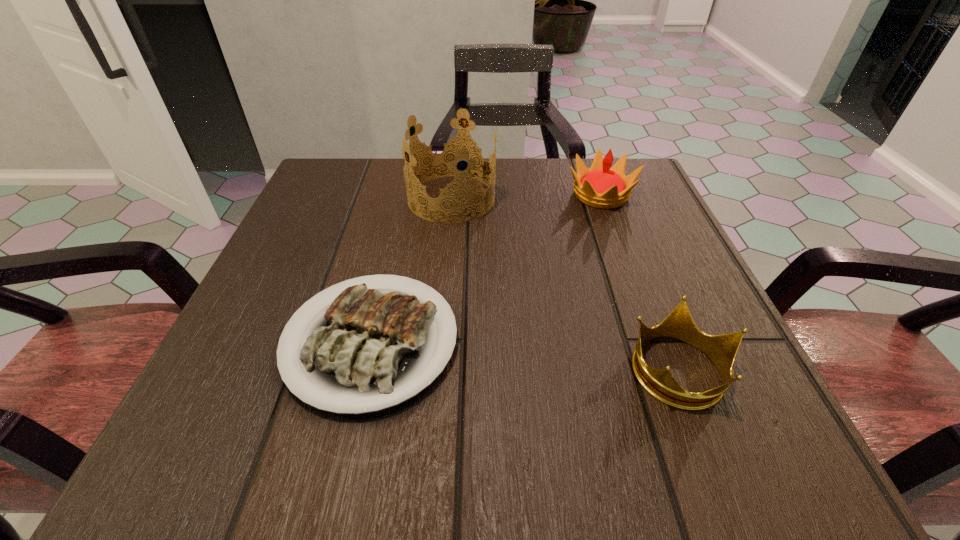
The width and height of the screenshot is (960, 540). What are the coordinates of `free space at the far left corner of the desktop` in the screenshot? It's located at (330, 205).

At what (x,y) coordinates should I click in order to perform the action: click on free space at the far right corner of the desktop. Please return your answer as a coordinate pair (x, y). This screenshot has height=540, width=960. Looking at the image, I should click on (636, 160).

At what (x,y) coordinates should I click in order to perform the action: click on vacant space that's between the plate and the leftmost crown. Please return your answer as a coordinate pair (x, y). The height and width of the screenshot is (540, 960). Looking at the image, I should click on [411, 270].

In order to click on empty space between the leftmost crown and the shortest object in this screenshot , I will do pos(411,270).

This screenshot has width=960, height=540. I want to click on free space between the leftmost crown and the shortest object, so click(x=411, y=270).

I want to click on vacant space that is in between the shortest object and the tallest crown, so click(411, 270).

At what (x,y) coordinates should I click in order to perform the action: click on free space between the tallest object and the second tallest crown. Please return your answer as a coordinate pair (x, y). Image resolution: width=960 pixels, height=540 pixels. Looking at the image, I should click on (526, 197).

Identify the location of unoccupied area between the shortest object and the tallest crown. Image resolution: width=960 pixels, height=540 pixels. (411, 270).

Locate an element on the screen. free spot between the second tallest object and the second shortest object is located at coordinates (640, 282).

The image size is (960, 540). In order to click on empty space that is in between the plate and the second tallest crown in this screenshot , I will do `click(486, 268)`.